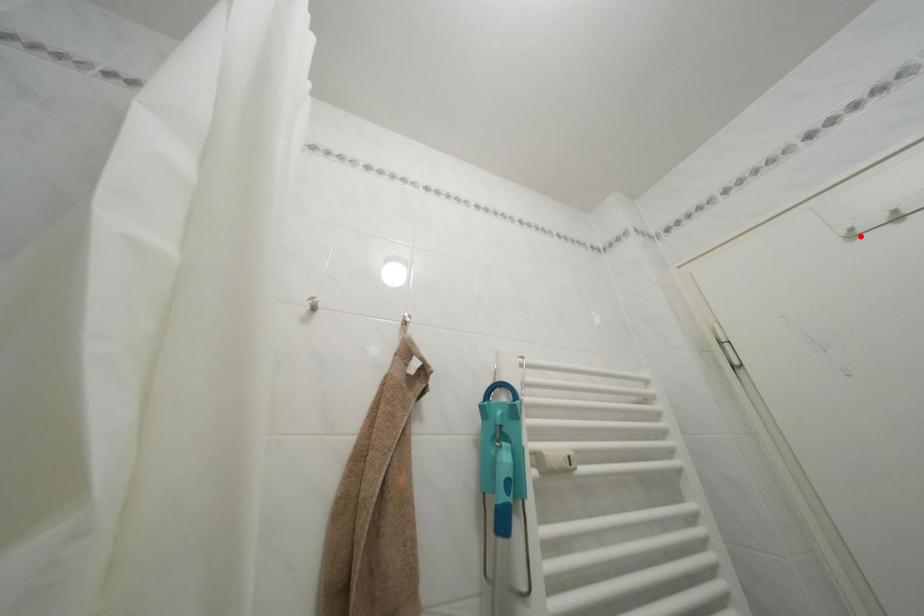
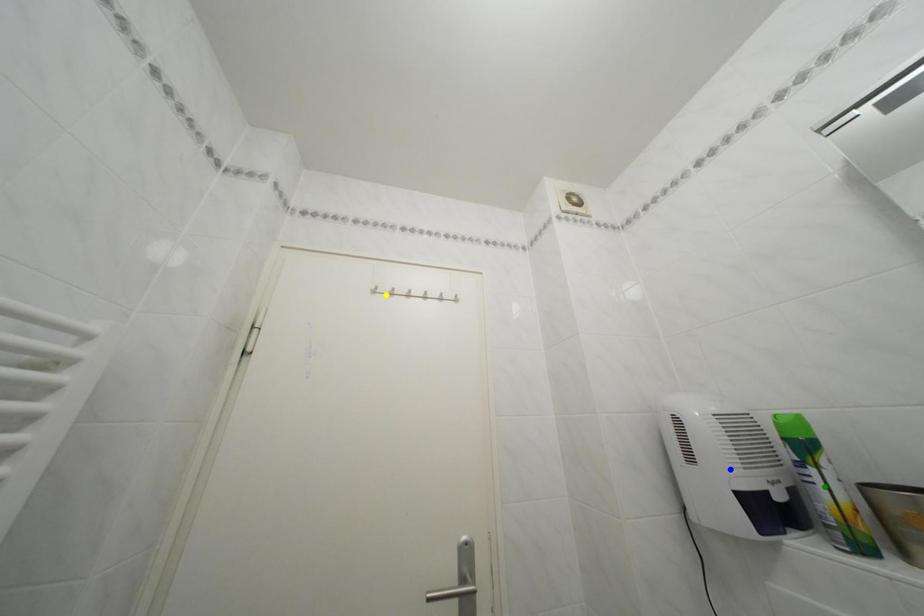
Question: I am providing you with two images of the same scene from different viewpoints. A red point is marked on the first image. You are given multiple points on the second image. Can you choose the point in image 2 that corresponds to the point in image 1?

Choices:
 (A) green point
 (B) yellow point
 (C) blue point

Answer: (B)